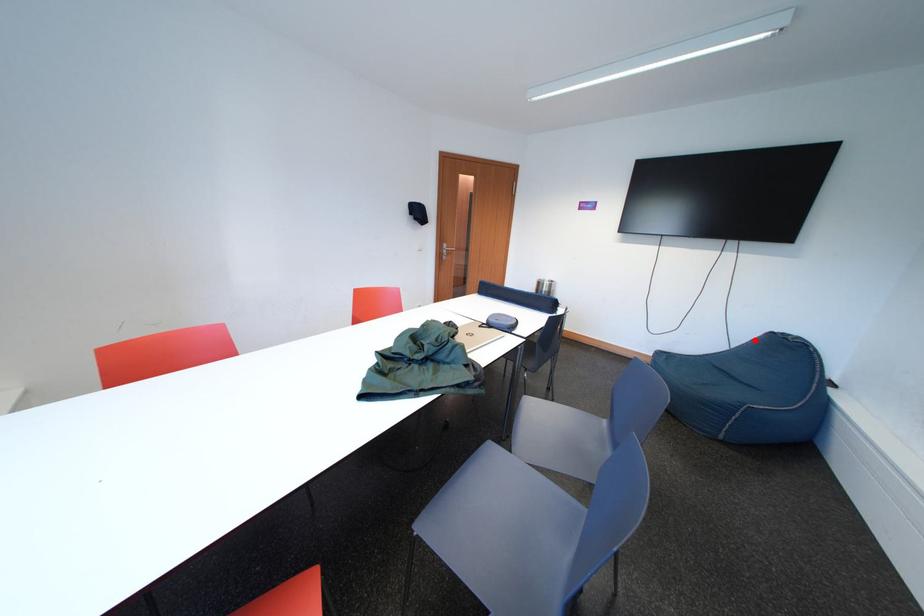
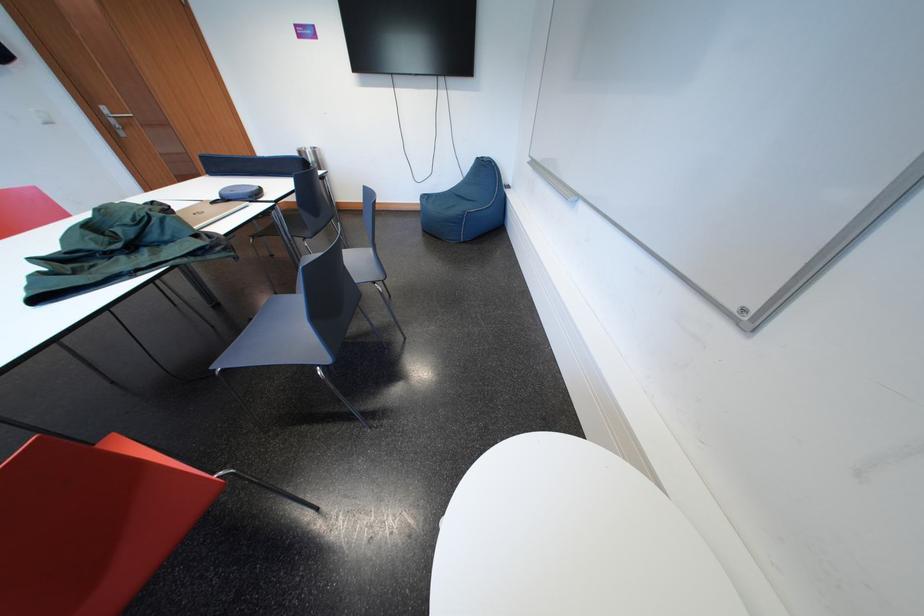
Find the pixel in the second image that matches the highlighted location in the first image.

(477, 169)